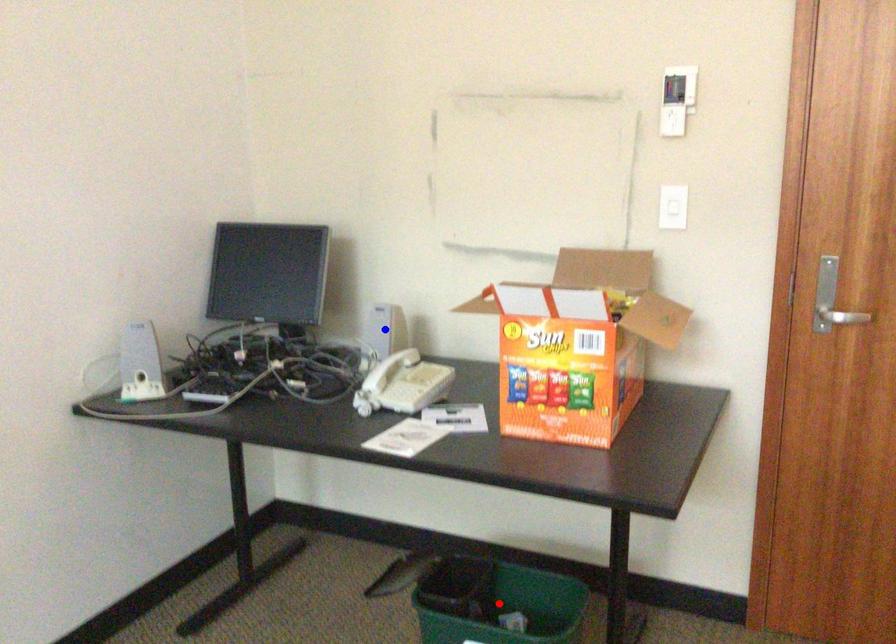
Question: In the image, two points are highlighted. Which point is nearer to the camera? Reply with the corresponding letter.

Choices:
 (A) blue point
 (B) red point

Answer: (B)